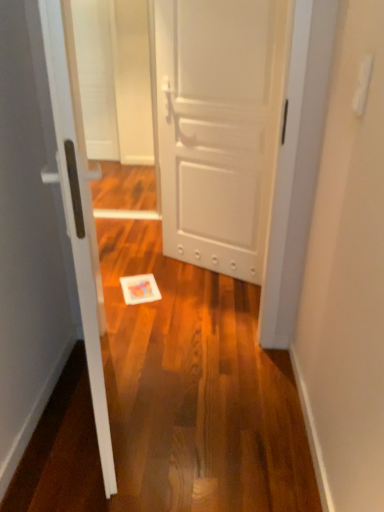
Question: Should I look upward or downward to see white glossy door at center, the second door from the back?

Choices:
 (A) down
 (B) up

Answer: (B)

Question: Can we say white glossy door at center, the second door from the back, lies outside white matte door at center, which appears as the 1th door when viewed from the right?

Choices:
 (A) yes
 (B) no

Answer: (A)

Question: From the image's perspective, is white glossy door at center, marked as the 1th door in a front-to-back arrangement, over white matte door at center, the 2th door in the left-to-right sequence?

Choices:
 (A) no
 (B) yes

Answer: (A)

Question: Is white glossy door at center, acting as the second door starting from the right, shorter than white matte door at center, the 2th door in the left-to-right sequence?

Choices:
 (A) yes
 (B) no

Answer: (A)

Question: Is white glossy door at center, acting as the second door starting from the right, next to white matte door at center, positioned as the 1th door in back-to-front order?

Choices:
 (A) yes
 (B) no

Answer: (B)

Question: From a real-world perspective, is white glossy door at center, marked as the 1th door in a front-to-back arrangement, on white matte door at center, which appears as the 1th door when viewed from the right?

Choices:
 (A) no
 (B) yes

Answer: (A)

Question: Is white glossy door at center, acting as the second door starting from the right, to the right of white matte door at center, which appears as the 1th door when viewed from the right, from the viewer's perspective?

Choices:
 (A) yes
 (B) no

Answer: (B)

Question: Does white matte door at center, which appears as the 1th door when viewed from the right, touch white glossy door at center, the first door viewed from the left?

Choices:
 (A) yes
 (B) no

Answer: (B)

Question: Considering the relative positions of white matte door at center, which appears as the second door when viewed from the front, and white glossy door at center, the first door viewed from the left, in the image provided, is white matte door at center, which appears as the second door when viewed from the front, to the right of white glossy door at center, the first door viewed from the left, from the viewer's perspective?

Choices:
 (A) yes
 (B) no

Answer: (A)

Question: Considering the relative positions of white matte door at center, which appears as the 1th door when viewed from the right, and white glossy door at center, the second door from the back, in the image provided, is white matte door at center, which appears as the 1th door when viewed from the right, to the left of white glossy door at center, the second door from the back, from the viewer's perspective?

Choices:
 (A) no
 (B) yes

Answer: (A)

Question: From the image's perspective, is white matte door at center, positioned as the 1th door in back-to-front order, under white glossy door at center, acting as the second door starting from the right?

Choices:
 (A) no
 (B) yes

Answer: (A)

Question: From the image's perspective, is white matte door at center, positioned as the 1th door in back-to-front order, located above white glossy door at center, the second door from the back?

Choices:
 (A) yes
 (B) no

Answer: (A)

Question: Can you confirm if white matte door at center, which appears as the second door when viewed from the front, is wider than white glossy door at center, the second door from the back?

Choices:
 (A) no
 (B) yes

Answer: (A)

Question: Is point (254, 88) closer or farther from the camera than point (61, 84)?

Choices:
 (A) farther
 (B) closer

Answer: (A)